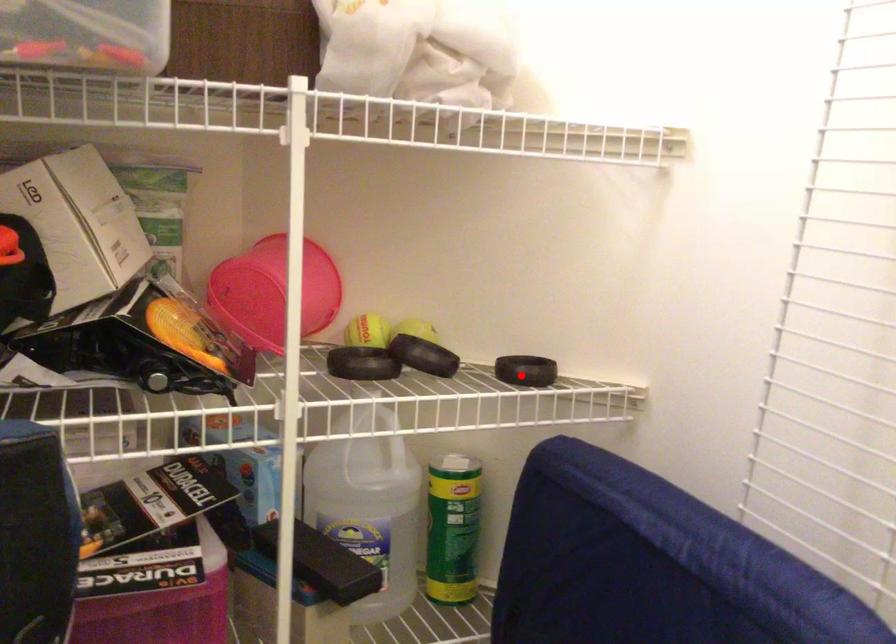
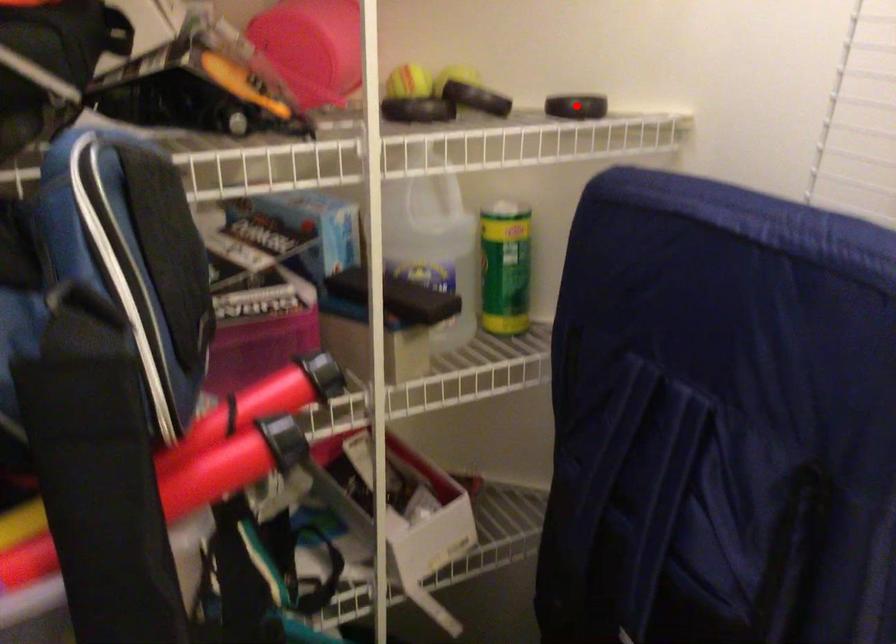
I am providing you with two images of the same scene from different viewpoints. A red point is marked on the first image and another point is marked on the second image. Is the marked point in image1 the same physical position as the marked point in image2?

Yes